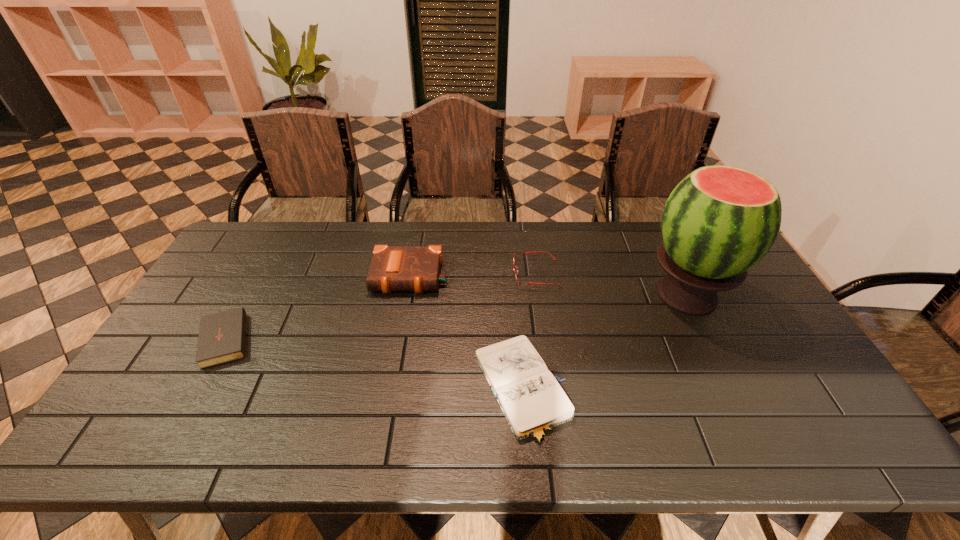
Find the location of a particular element. This screenshot has height=540, width=960. the tallest object is located at coordinates (719, 221).

Where is `watermelon`? watermelon is located at coordinates (719, 221).

You are a GUI agent. You are given a task and a screenshot of the screen. Output one action in this format:
    pyautogui.click(x=<x>, y=<y>)
    Task: Click on the right Bible
    This screenshot has width=960, height=540.
    Given the screenshot: What is the action you would take?
    pyautogui.click(x=393, y=268)

You are a GUI agent. You are given a task and a screenshot of the screen. Output one action in this format:
    pyautogui.click(x=<x>, y=<y>)
    Task: Click on the farther Bible
    
    Given the screenshot: What is the action you would take?
    pyautogui.click(x=393, y=268)

The image size is (960, 540). I want to click on spectacles, so click(521, 253).

Locate an element on the screen. The image size is (960, 540). the nearer Bible is located at coordinates (222, 336).

Image resolution: width=960 pixels, height=540 pixels. Identify the location of the leftmost object. (222, 336).

Where is `notebook`? This screenshot has width=960, height=540. notebook is located at coordinates (533, 402).

Locate an element on the screen. vacant space located on the back of the watermelon is located at coordinates (653, 227).

At what (x,y) coordinates should I click in order to perform the action: click on blank space located 0.220m on the spine side of the taller Bible. Please return your answer as a coordinate pair (x, y). Looking at the image, I should click on (397, 354).